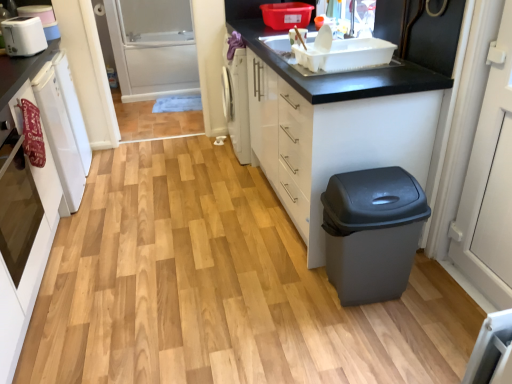
You are a GUI agent. You are given a task and a screenshot of the screen. Output one action in this format:
    pyautogui.click(x=<x>, y=<y>)
    Task: Click on the vacant area in front of white plastic sink at upper center
    The image size is (512, 384).
    Given the screenshot: What is the action you would take?
    pyautogui.click(x=342, y=79)